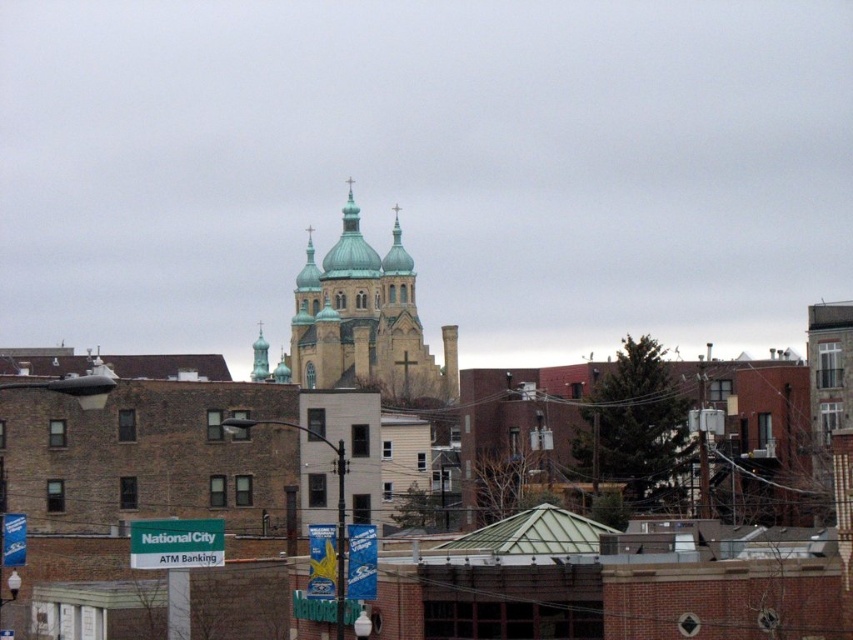
Is point (45, 448) farther from camera compared to point (218, 564)?

Yes, point (45, 448) is behind point (218, 564).

Consider the image. Is stone church at center thinner than green plastic sign at lower left?

No.

Who is more distant from viewer, (693, 611) or (160, 532)?

The point (160, 532) is behind.

This screenshot has height=640, width=853. In order to click on stone church at center in this screenshot , I will do `click(608, 593)`.

Is stone church at center closer to camera compared to green glazed dome at center?

That is True.

Measure the distance between stone church at center and camera.

The distance of stone church at center from camera is 223.80 feet.

I want to click on stone church at center, so click(608, 593).

What do you see at coordinates (364, 321) in the screenshot? The image size is (853, 640). I see `green glazed dome at center` at bounding box center [364, 321].

Does green glazed dome at center appear on the left side of green plastic sign at lower left?

No, green glazed dome at center is not to the left of green plastic sign at lower left.

Find the location of a particular element. Image resolution: width=853 pixels, height=640 pixels. green glazed dome at center is located at coordinates (364, 321).

The image size is (853, 640). What are the coordinates of `green glazed dome at center` in the screenshot? It's located at (364, 321).